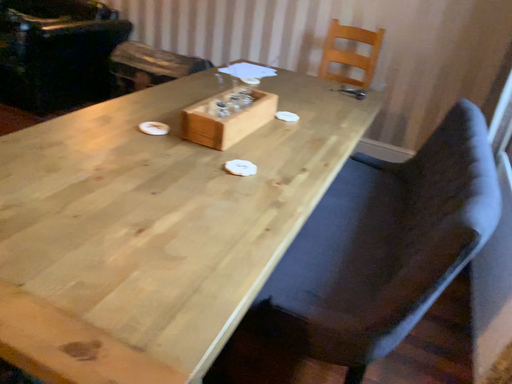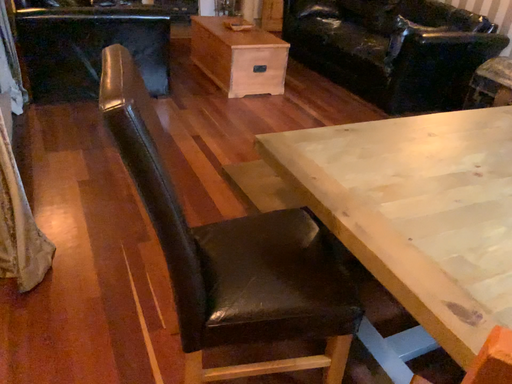
Question: How did the camera likely rotate when shooting the video?

Choices:
 (A) rotated upward
 (B) rotated downward

Answer: (A)